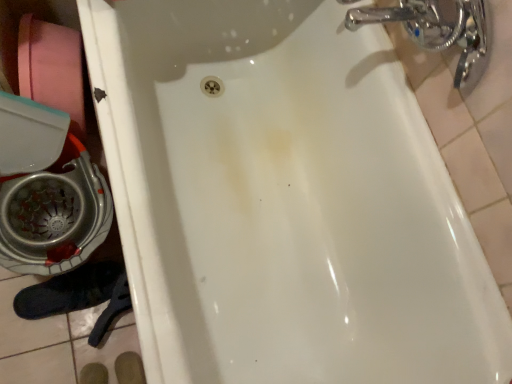
Describe the element at coordinates (438, 31) in the screenshot. I see `chrome metallic faucet at upper right` at that location.

Where is `chrome metallic faucet at upper right`? The width and height of the screenshot is (512, 384). chrome metallic faucet at upper right is located at coordinates (438, 31).

Between point (26, 23) and point (31, 300), which one is positioned in front?

The point (26, 23) is more forward.

Is pink cardboard toilet paper at left looking in the opposite direction of black suede shoe at lower left?

pink cardboard toilet paper at left does not have its back to black suede shoe at lower left.

Is pink cardboard toilet paper at left bigger or smaller than black suede shoe at lower left?

Considering their sizes, pink cardboard toilet paper at left takes up more space than black suede shoe at lower left.

Is chrome metallic faucet at upper right not within pink cardboard toilet paper at left?

Indeed, chrome metallic faucet at upper right is completely outside pink cardboard toilet paper at left.

Which point is more forward, (471, 19) or (48, 98)?

The point (471, 19) is more forward.

From a real-world perspective, which object stands above the other?

chrome metallic faucet at upper right, from a real-world perspective.

Does chrome metallic faucet at upper right have a lesser height compared to pink cardboard toilet paper at left?

Yes, chrome metallic faucet at upper right is shorter than pink cardboard toilet paper at left.

How different are the orientations of black suede shoe at lower left and pink cardboard toilet paper at left in degrees?

They differ by 4.14 degrees in their facing directions.

Who is taller, black suede shoe at lower left or pink cardboard toilet paper at left?

pink cardboard toilet paper at left is taller.

Consider the image. From a real-world perspective, is black suede shoe at lower left positioned over pink cardboard toilet paper at left based on gravity?

No.

Does black suede shoe at lower left have a smaller size compared to pink cardboard toilet paper at left?

Yes.

Locate an element on the screen. shoe behind the chrome metallic faucet at upper right is located at coordinates click(x=70, y=291).

What's the angular difference between chrome metallic faucet at upper right and black suede shoe at lower left's facing directions?

The facing directions of chrome metallic faucet at upper right and black suede shoe at lower left are 2 degrees apart.

Would you say chrome metallic faucet at upper right contains black suede shoe at lower left?

No, black suede shoe at lower left is located outside of chrome metallic faucet at upper right.

Considering the sizes of objects chrome metallic faucet at upper right and black suede shoe at lower left in the image provided, who is bigger, chrome metallic faucet at upper right or black suede shoe at lower left?

chrome metallic faucet at upper right is bigger.

How far apart are black suede shoe at lower left and chrome metallic faucet at upper right?

black suede shoe at lower left is 96.13 centimeters away from chrome metallic faucet at upper right.

In the scene shown: In terms of width, does black suede shoe at lower left look wider or thinner when compared to chrome metallic faucet at upper right?

Clearly, black suede shoe at lower left has more width compared to chrome metallic faucet at upper right.

Could you tell me if black suede shoe at lower left is facing chrome metallic faucet at upper right?

No.

From the image's perspective, which is below, pink cardboard toilet paper at left or chrome metallic faucet at upper right?

pink cardboard toilet paper at left is shown below in the image.

How different are the orientations of pink cardboard toilet paper at left and chrome metallic faucet at upper right in degrees?

The facing directions of pink cardboard toilet paper at left and chrome metallic faucet at upper right are 6.14 degrees apart.

Which is more to the right, pink cardboard toilet paper at left or chrome metallic faucet at upper right?

From the viewer's perspective, chrome metallic faucet at upper right appears more on the right side.

Would you say pink cardboard toilet paper at left is a long distance from chrome metallic faucet at upper right?

Actually, pink cardboard toilet paper at left and chrome metallic faucet at upper right are a little close together.

Where is `shoe on the right of pink cardboard toilet paper at left`? Image resolution: width=512 pixels, height=384 pixels. shoe on the right of pink cardboard toilet paper at left is located at coordinates (70, 291).

This screenshot has width=512, height=384. In order to click on toilet paper below the chrome metallic faucet at upper right (from the image's perspective) in this screenshot , I will do `click(52, 68)`.

Looking at the image, which one is located closer to pink cardboard toilet paper at left, chrome metallic faucet at upper right or black suede shoe at lower left?

Among the two, black suede shoe at lower left is located nearer to pink cardboard toilet paper at left.

Looking at this image, which object lies nearer to the anchor point black suede shoe at lower left, pink cardboard toilet paper at left or chrome metallic faucet at upper right?

Based on the image, pink cardboard toilet paper at left appears to be nearer to black suede shoe at lower left.

Which object lies further to the anchor point chrome metallic faucet at upper right, black suede shoe at lower left or pink cardboard toilet paper at left?

black suede shoe at lower left is positioned further to the anchor chrome metallic faucet at upper right.

From the image, which object appears to be nearer to pink cardboard toilet paper at left, black suede shoe at lower left or chrome metallic faucet at upper right?

black suede shoe at lower left.

Looking at the image, which one is located closer to black suede shoe at lower left, chrome metallic faucet at upper right or pink cardboard toilet paper at left?

Based on the image, pink cardboard toilet paper at left appears to be nearer to black suede shoe at lower left.

Which object lies further to the anchor point chrome metallic faucet at upper right, pink cardboard toilet paper at left or black suede shoe at lower left?

black suede shoe at lower left is further to chrome metallic faucet at upper right.

You are a GUI agent. You are given a task and a screenshot of the screen. Output one action in this format:
    pyautogui.click(x=<x>, y=<y>)
    Task: Click on the shoe between pink cardboard toilet paper at left and chrome metallic faucet at upper right
    This screenshot has height=384, width=512.
    Given the screenshot: What is the action you would take?
    pyautogui.click(x=70, y=291)